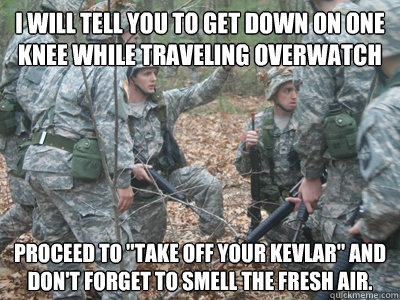
Where is `wall`? The image size is (400, 300). wall is located at coordinates (29, 29).